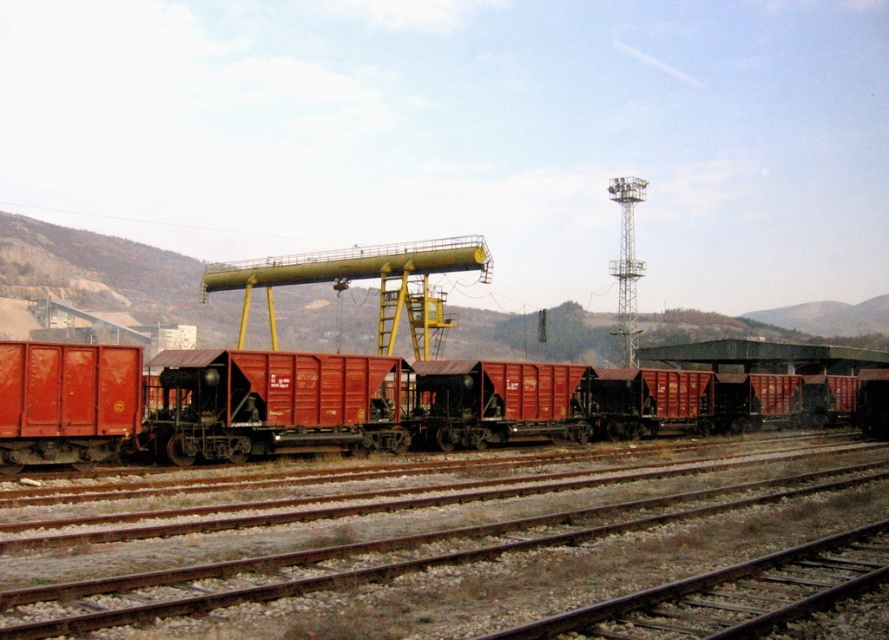
Question: Which point appears farthest from the camera in this image?

Choices:
 (A) (831, 531)
 (B) (617, 612)

Answer: (A)

Question: Considering the relative positions of smooth metal tracks at center and smooth metal train track at lower right in the image provided, where is smooth metal tracks at center located with respect to smooth metal train track at lower right?

Choices:
 (A) right
 (B) left

Answer: (A)

Question: Which of these objects is positioned closest to the smooth metal train track at lower right?

Choices:
 (A) smooth metal tracks at center
 (B) rusty metal train carriages at center

Answer: (A)

Question: From the image, what is the correct spatial relationship of smooth metal tracks at center in relation to rusty metal train carriages at center?

Choices:
 (A) below
 (B) above

Answer: (A)

Question: Which object is the closest to the smooth metal tracks at center?

Choices:
 (A) rusty metal train carriages at center
 (B) smooth metal train track at lower right

Answer: (A)

Question: Is smooth metal tracks at center smaller than rusty metal train carriages at center?

Choices:
 (A) yes
 (B) no

Answer: (A)